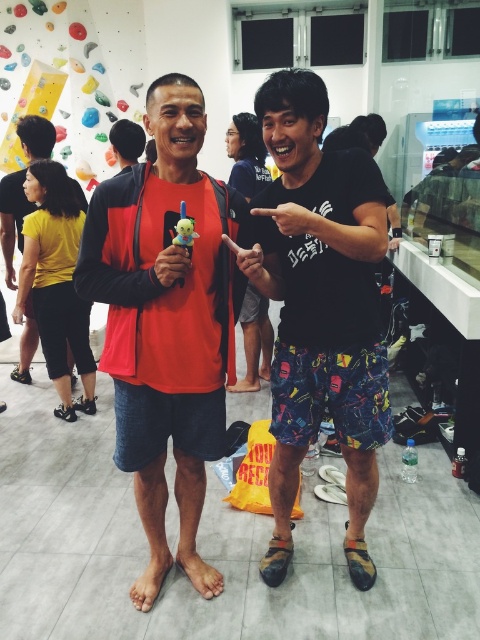
You are a photographer trying to capture a closeup of the black matte shorts at center and the matte orange tank top at center. Since you want to focus on both items equally, which one should you adjust your camera settings to prioritize in terms of focus distance?

The black matte shorts at center is smaller than the matte orange tank top at center, so you should prioritize focusing on the matte orange tank top at center because it is larger and will require more detailed focus to capture properly.

You are standing at the entrance of the climbing gym and see the matte orange shirt at center in the image. If you want to walk directly towards it, which direction should you move relative to your current position?

Since the matte orange shirt at center is located at point coordinates 0.505 on the x axis and 0.348 on the y axis, you should move forward and slightly to the right to reach it.

You are a photographer setting up a shoot in this climbing gym. You need to ensure that the matte orange shirt at center and the black matte shorts at center are both visible in the frame. Based on their positions, which one should you focus on first to capture both items in the shot?

The matte orange shirt at center is located below the black matte shorts at center, so focusing on the black matte shorts at center first would allow both items to be captured in the frame since the shirt is positioned lower.